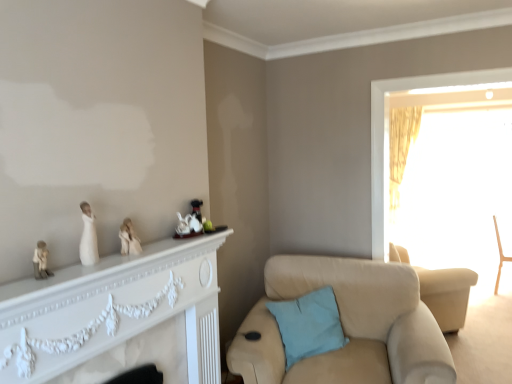
You are a GUI agent. You are given a task and a screenshot of the screen. Output one action in this format:
    pyautogui.click(x=<x>, y=<y>)
    Task: Click on the free spot in front of white porcelain figurine at center, which is the second person in front-to-back order
    This screenshot has height=384, width=512.
    Given the screenshot: What is the action you would take?
    pyautogui.click(x=111, y=262)